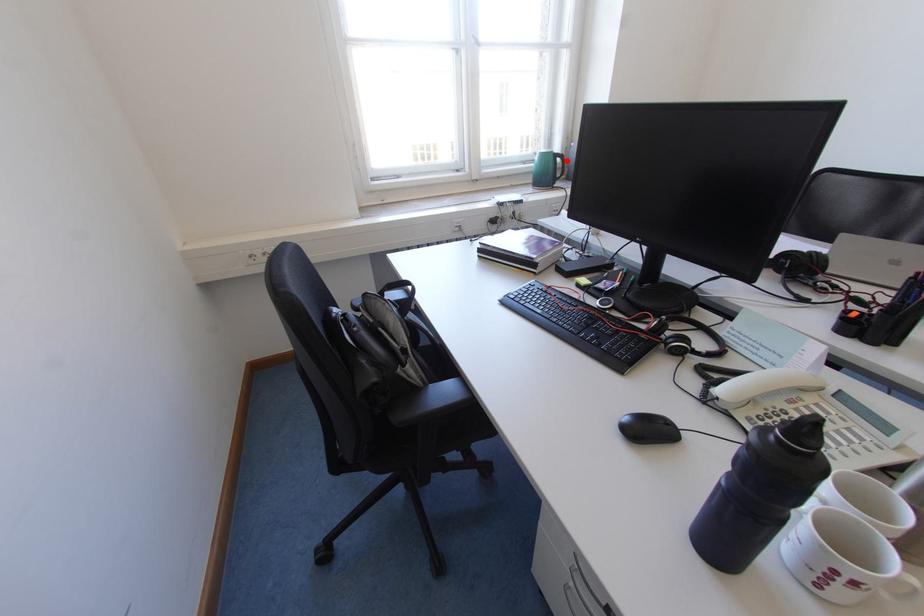
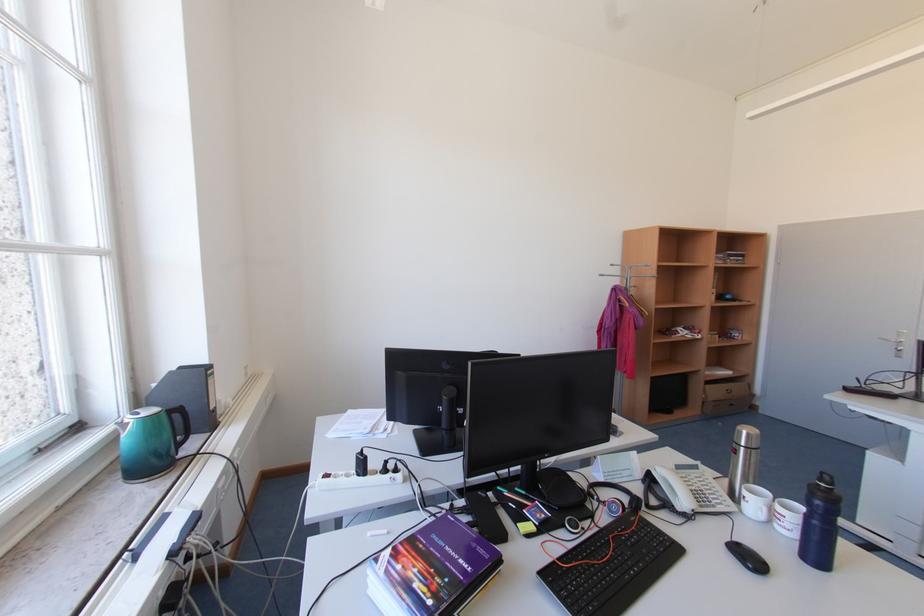
Question: I am providing you with two images of the same scene from different viewpoints. In image1, a red point is highlighted. Considering the same 3D point in image2, which of the following is correct?

Choices:
 (A) It is closer
 (B) It is farther

Answer: (B)